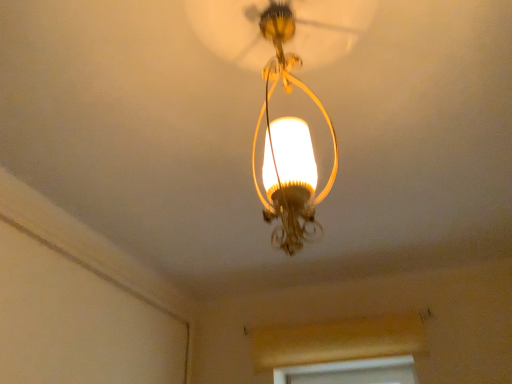
Question: From the image's perspective, is matte gold chandelier at center located above or below wooden window frame at lower center?

Choices:
 (A) below
 (B) above

Answer: (B)

Question: Is matte gold chandelier at center spatially inside wooden window frame at lower center, or outside of it?

Choices:
 (A) inside
 (B) outside

Answer: (B)

Question: Is point (293, 66) positioned closer to the camera than point (343, 344)?

Choices:
 (A) closer
 (B) farther

Answer: (A)

Question: Is wooden window frame at lower center in front of or behind matte gold chandelier at center in the image?

Choices:
 (A) front
 (B) behind

Answer: (B)

Question: Choose the correct answer: Is wooden window frame at lower center inside matte gold chandelier at center or outside it?

Choices:
 (A) inside
 (B) outside

Answer: (B)

Question: Visually, is wooden window frame at lower center positioned to the left or to the right of matte gold chandelier at center?

Choices:
 (A) left
 (B) right

Answer: (B)

Question: From the image's perspective, is wooden window frame at lower center positioned above or below matte gold chandelier at center?

Choices:
 (A) above
 (B) below

Answer: (B)